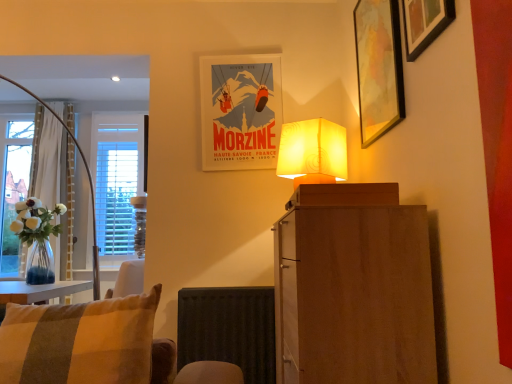
Question: In terms of width, does wooden picture frame at upper right, the 3th picture frame positioned from the back, look wider or thinner when compared to wooden cabinet at center?

Choices:
 (A) thin
 (B) wide

Answer: (A)

Question: From a real-world perspective, is wooden picture frame at upper right, positioned as the 1th picture frame in front-to-back order, above or below wooden cabinet at center?

Choices:
 (A) below
 (B) above

Answer: (B)

Question: Estimate the real-world distances between objects in this image. Which object is farther from the white wooden blinds at left?

Choices:
 (A) matte paper poster at upper center, the third picture frame viewed from the right
 (B) white sheer curtain at left
 (C) wooden picture frame at upper right, the second picture frame in the right-to-left sequence
 (D) black matte radiator at lower center
 (E) wooden picture frame at upper right, which is counted as the 1th picture frame, starting from the right

Answer: (E)

Question: Considering the real-world distances, which object is closest to the wooden picture frame at upper right, which is counted as the 1th picture frame, starting from the right?

Choices:
 (A) matte paper poster at upper center, the 3th picture frame in the front-to-back sequence
 (B) striped fabric cushion at lower left
 (C) white sheer curtain at left
 (D) wooden picture frame at upper right, the 2th picture frame in the front-to-back sequence
 (E) wooden cabinet at center

Answer: (D)